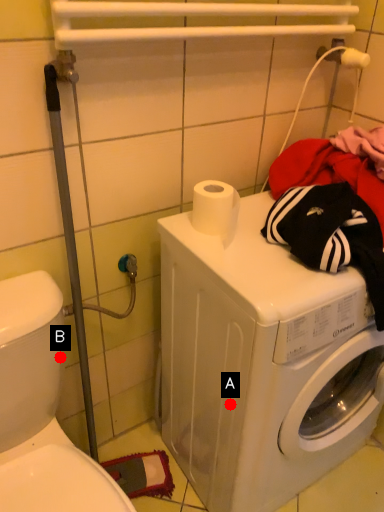
Question: Two points are circled on the image, labeled by A and B beside each circle. Which point is farther to the camera?

Choices:
 (A) A is further
 (B) B is further

Answer: (B)